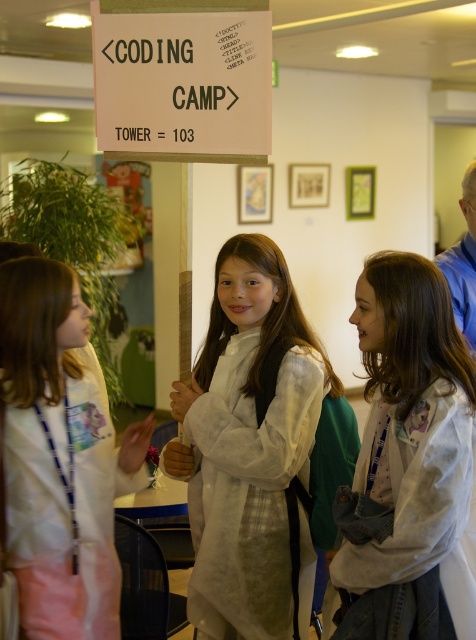
You are standing in the CODING CAMP area and need to reach the point closer to you. Which point should you head towards, point (x=274, y=522) or point (x=51, y=413)?

You should head towards point (x=51, y=413) because it is closer to you than point (x=274, y=522).

You are a photographer trying to capture a group photo of the children in the coding camp. The two white lab coats, the white cotton lab coat at center and the white lab coat at left, are part of the group. Given that the minimum recommended distance for a clear group photo is 40 centimeters between subjects, will you be able to capture them clearly in the photo?

The white cotton lab coat at center is 41.42 centimeters from the white lab coat at left, which exceeds the minimum recommended distance of 40 centimeters. Therefore, you can capture them clearly in the photo.